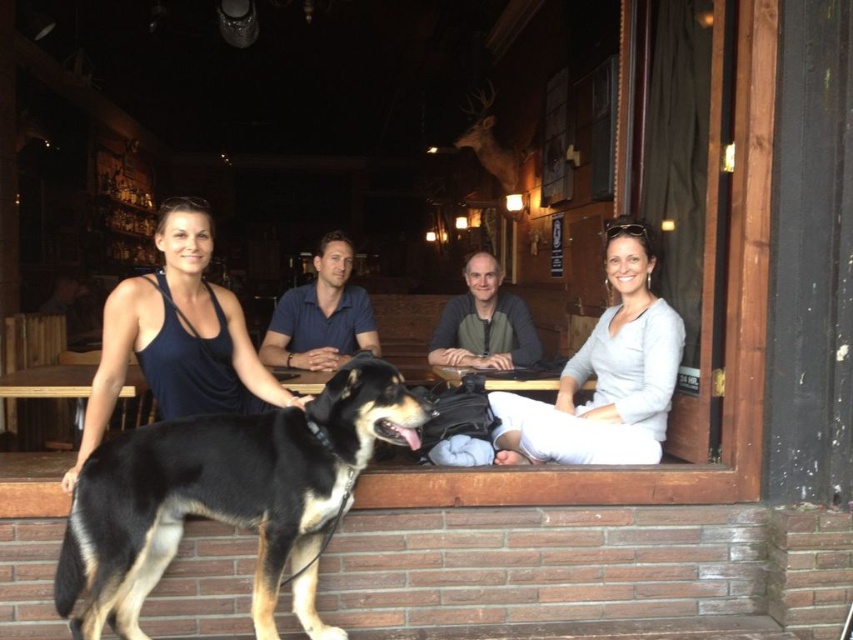
You are a painter who needs to place a 1.2 meter wide canvas between the wooden frame at center and the matte black tank top at center. Is there enough space?

The wooden frame at center and matte black tank top at center are 1.00 meters apart, so the 1.2 meter wide canvas would not fit between them since the distance is shorter than the canvas width.

You are standing at the entrance of the bar and want to move towards the group sitting on the window sill. Which point, point (x=207, y=253) or point (x=515, y=324), would you reach first?

Point (x=207, y=253) is in front of point (x=515, y=324), so you would reach point (x=207, y=253) first.

You are a photographer planning to take a group photo of the people sitting on the wooden window sill. You notice the wooden frame at center and the matte black tank top at center in your shot. Which object should you adjust to ensure both are clearly visible in the frame?

The wooden frame at center is larger in size than the matte black tank top at center, so you should adjust the wooden frame at center to ensure both are clearly visible in the frame.